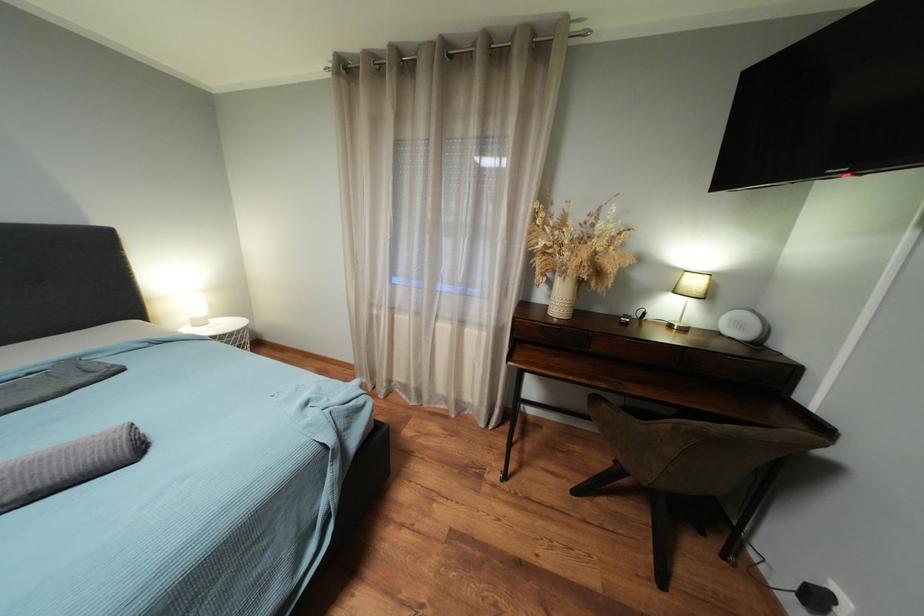
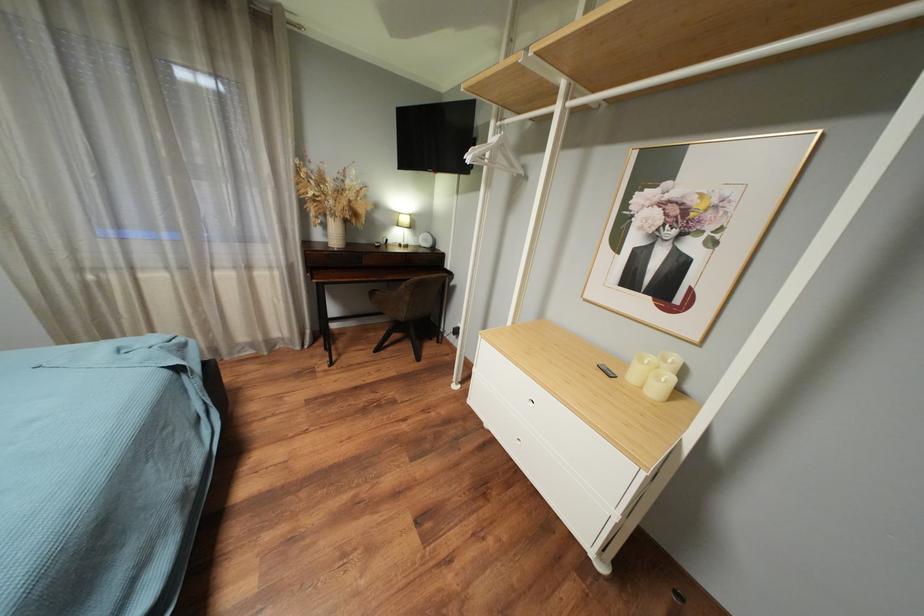
Question: Based on the continuous images, in which direction is the camera rotating? Reply with the corresponding letter.

Choices:
 (A) Left
 (B) Right
 (C) Up
 (D) Down

Answer: (B)